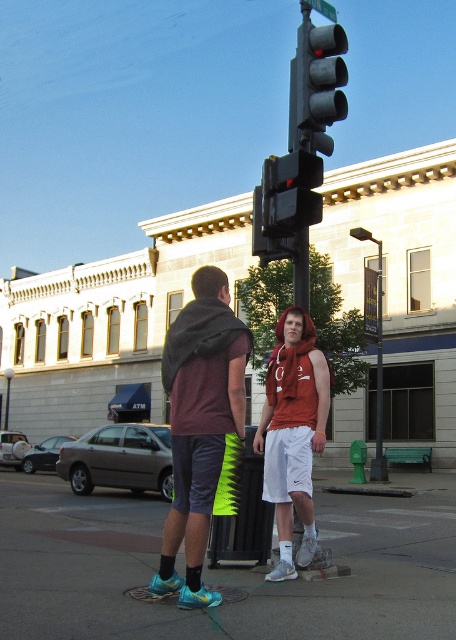
Question: Among these points, which one is farthest from the camera?

Choices:
 (A) (281, 513)
 (B) (310, 212)
 (C) (216, 376)

Answer: (B)

Question: Is matte maroon t-shirt at center in front of metallic gray traffic light at upper center?

Choices:
 (A) no
 (B) yes

Answer: (B)

Question: Which object appears farthest from the camera in this image?

Choices:
 (A) metallic black traffic light at center
 (B) matte maroon t-shirt at center
 (C) metallic gray traffic light at upper center

Answer: (C)

Question: Which object is positioned closest to the matte red hoodie at center?

Choices:
 (A) metallic gray traffic light at upper center
 (B) matte maroon t-shirt at center

Answer: (B)

Question: Is matte maroon t-shirt at center bigger than metallic gray traffic light at upper center?

Choices:
 (A) no
 (B) yes

Answer: (A)

Question: In this image, where is matte red hoodie at center located relative to metallic gray traffic light at upper center?

Choices:
 (A) above
 (B) below

Answer: (B)